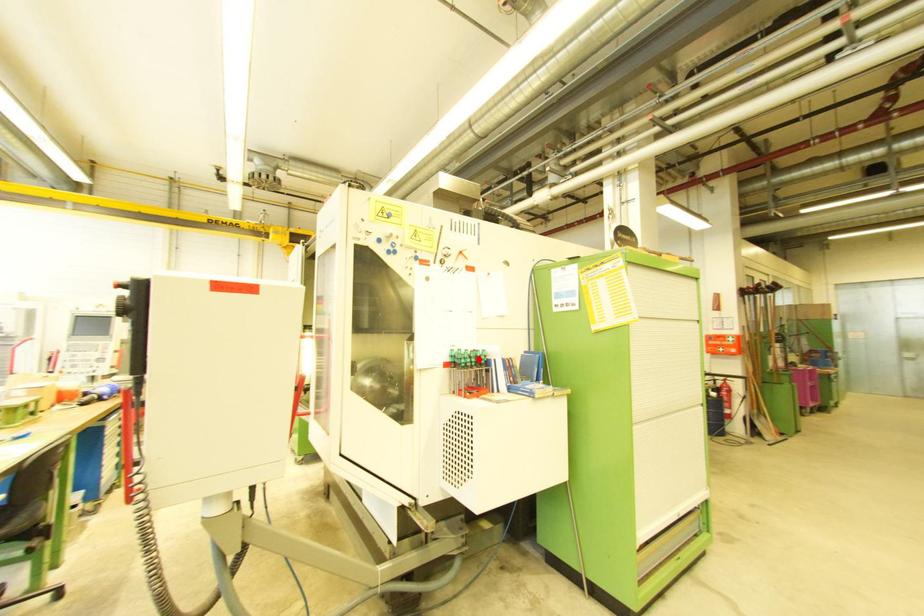
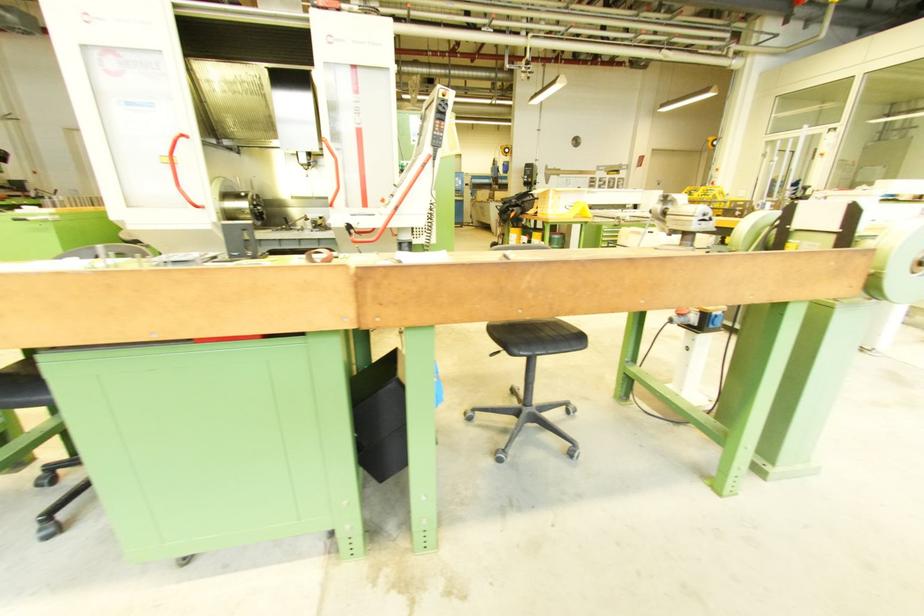
Question: I am providing you with two images of the same scene from different viewpoints. A red point is marked on the first image. Can you still see the location of the red point in image 2?

Choices:
 (A) Yes
 (B) No

Answer: (B)